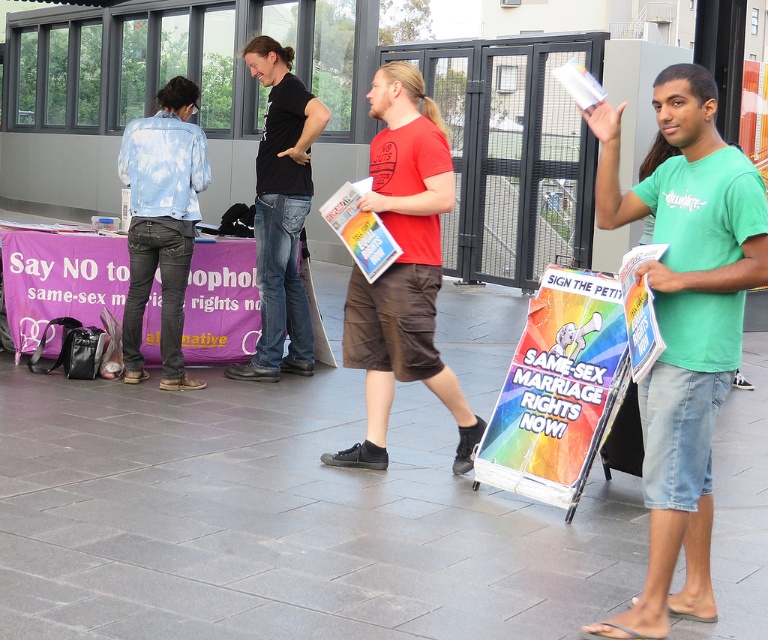
Can you confirm if rainbow paper flyer at center is taller than matte paper poster at right?

Yes.

Who is more distant from viewer, (358, 182) or (659, 248)?

The point (358, 182) is behind.

Between point (366, 268) and point (624, 291), which one is positioned in front?

Point (624, 291)

At what (x,y) coordinates should I click in order to perform the action: click on rainbow paper flyer at center. Please return your answer as a coordinate pair (x, y). Looking at the image, I should click on pyautogui.click(x=359, y=228).

Consider the image. Which of these two, red matte t-shirt at center or rainbow paper sign at center, stands shorter?

rainbow paper sign at center is shorter.

Between red matte t-shirt at center and rainbow paper sign at center, which one appears on the right side from the viewer's perspective?

rainbow paper sign at center

Is point (346, 305) positioned in front of point (492, 483)?

No, (346, 305) is further to viewer.

This screenshot has width=768, height=640. I want to click on red matte t-shirt at center, so click(402, 268).

Between green cotton t-shirt at center and rainbow paper sign at center, which one has more height?

green cotton t-shirt at center is taller.

Describe the element at coordinates (684, 326) in the screenshot. Image resolution: width=768 pixels, height=640 pixels. I see `green cotton t-shirt at center` at that location.

Is point (697, 378) closer to viewer compared to point (576, 480)?

Yes, point (697, 378) is in front of point (576, 480).

This screenshot has width=768, height=640. I want to click on green cotton t-shirt at center, so 684,326.